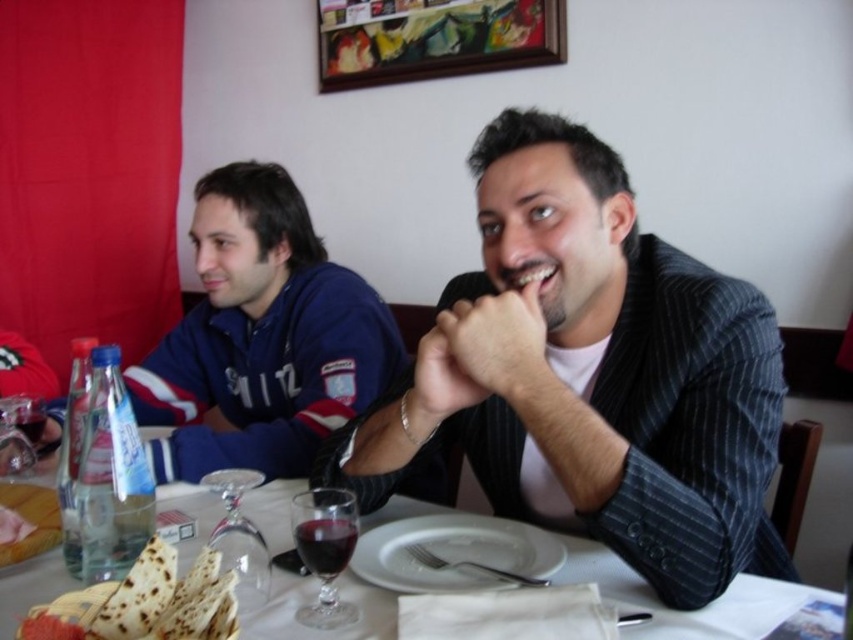
You are standing at the point labeled as point [473,472] in the image. If you want to move 1 meter towards the viewer, will you be able to do so without stepping outside the image area?

The distance between point [473,472] and the viewer is 1.16 meters. Moving 1 meter towards the viewer would leave you 0.16 meters away from the viewer, which is still within the image area. So yes, you can move 1 meter towards the viewer without stepping outside the image area.

You are a waiter in a restaurant and need to place a new dish on the table. The table has a white glossy plate at center located at point (695, 611). Where should you place the new dish to ensure it is directly north of the white glossy plate at center?

To place the new dish directly north of the white glossy plate at center, you should position it at a point with the same x coordinate as the plate but a lower y coordinate, since in coordinate systems, north corresponds to decreasing y values. Therefore, the new dish should be placed at a point like 0.955, 0.750, assuming the coordinate system decreases y values moving north.

You are a server who needs to place a 6.5 inch wide decorative item on the table between the white glossy plate at center and the transparent glass wine glass at center. Can you fit it there?

The distance between the white glossy plate at center and the transparent glass wine glass at center is 6.43 inches, which is slightly less than the 6.5 inch wide decorative item. Therefore, the item may not fit comfortably between them.